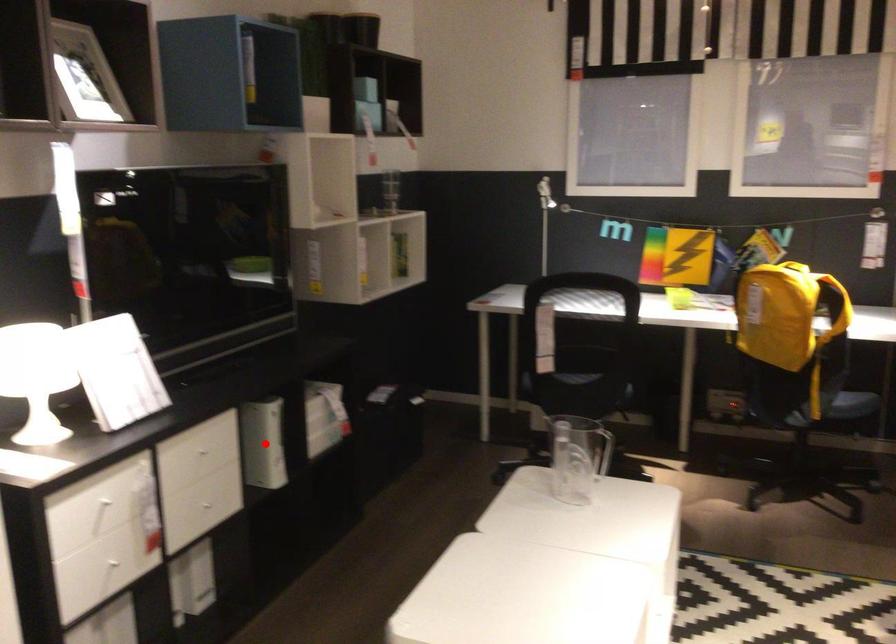
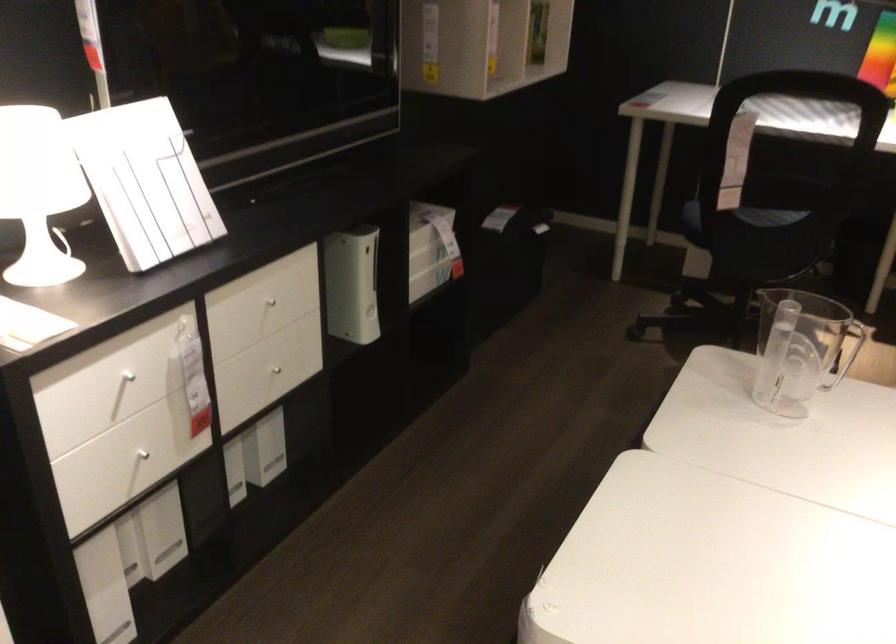
Question: I am providing you with two images of the same scene from different viewpoints. A red point is shown in image1. For the corresponding object point in image2, is it positioned nearer or farther from the camera?

Choices:
 (A) Nearer
 (B) Farther

Answer: (A)